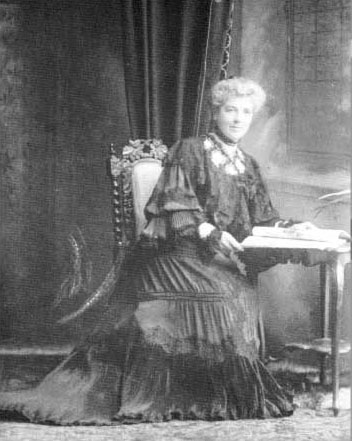
Find the location of a particular element. reading material is located at coordinates (305, 244).